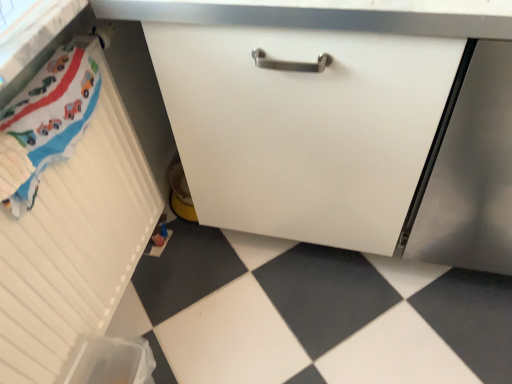
Question: From a real-world perspective, is white glossy tile at lower left positioned above or below white matte radiator at left, the second cabinetry when ordered from right to left?

Choices:
 (A) above
 (B) below

Answer: (B)

Question: Is white glossy tile at lower left inside the boundaries of white matte radiator at left, the second cabinetry when ordered from right to left, or outside?

Choices:
 (A) outside
 (B) inside

Answer: (A)

Question: Estimate the real-world distances between objects in this image. Which object is farther from the white matte cabinet at center, which ranks as the 1th cabinetry in right-to-left order?

Choices:
 (A) white matte radiator at left, the second cabinetry when ordered from right to left
 (B) white glossy tile at lower left
 (C) satin silver screen door at lower right

Answer: (A)

Question: Which is nearer to the satin silver screen door at lower right?

Choices:
 (A) white glossy tile at lower left
 (B) white matte radiator at left, which is the first cabinetry from left to right
 (C) white matte cabinet at center, which ranks as the 1th cabinetry in right-to-left order

Answer: (C)